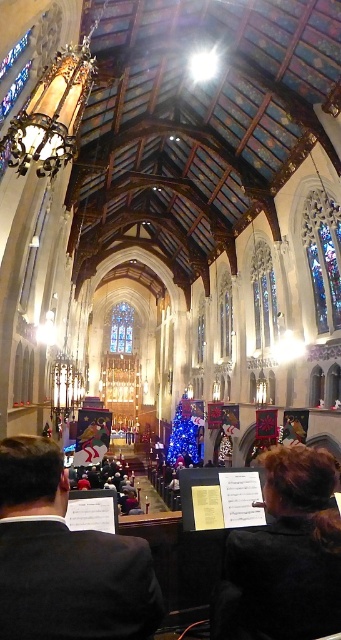
Question: Which object is closer to the camera taking this photo?

Choices:
 (A) dark suit at center
 (B) stained glass window at upper right
 (C) stained glass window at upper center

Answer: (A)

Question: Can you confirm if dark suit at center is thinner than stained glass window at upper center?

Choices:
 (A) no
 (B) yes

Answer: (A)

Question: Can you confirm if stained glass window at upper right is smaller than stained glass window at upper center?

Choices:
 (A) yes
 (B) no

Answer: (B)

Question: Is stained glass window at upper right positioned in front of stained glass window at center?

Choices:
 (A) no
 (B) yes

Answer: (B)

Question: Which point is closer to the camera?

Choices:
 (A) stained glass window at upper right
 (B) stained glass window at upper center
 (C) stained glass window at center

Answer: (B)

Question: Which object is farther from the camera taking this photo?

Choices:
 (A) stained glass window at upper center
 (B) stained glass window at upper right
 (C) dark suit at center

Answer: (B)